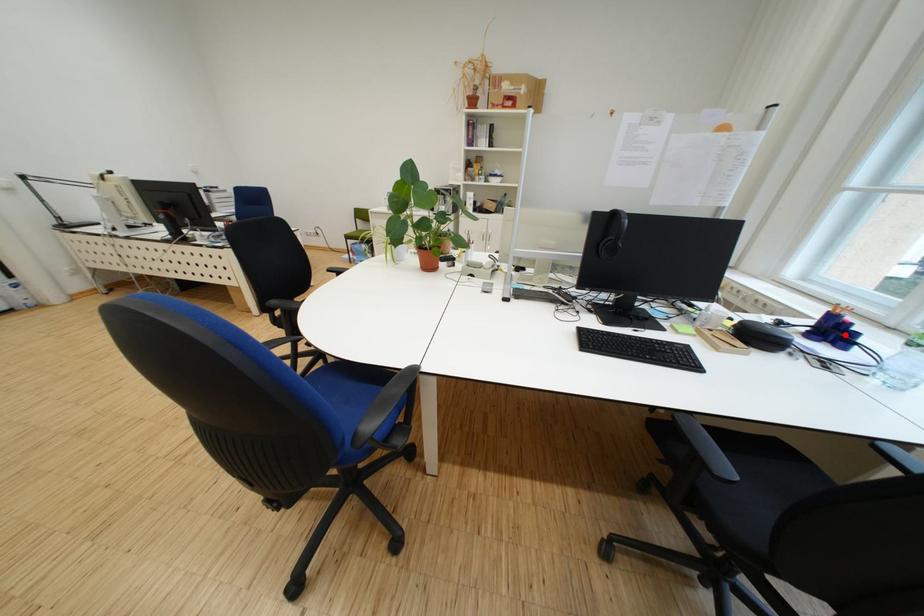
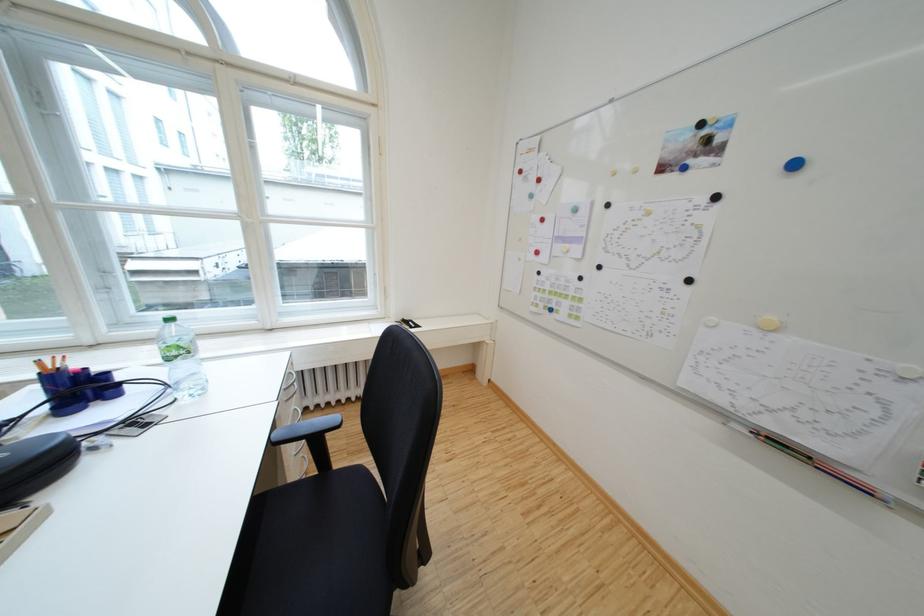
Question: I am providing you with two images of the same scene from different viewpoints. In image1, a red point is highlighted. Considering the same 3D point in image2, which of the following is correct?

Choices:
 (A) It is closer
 (B) It is farther

Answer: (A)